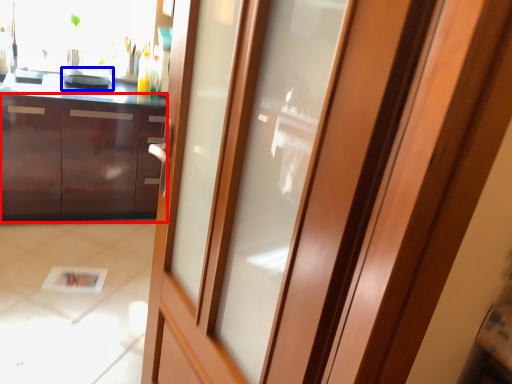
Question: Which point is further to the camera, cabinetry (highlighted by a red box) or appliance (highlighted by a blue box)?

Choices:
 (A) cabinetry
 (B) appliance

Answer: (B)